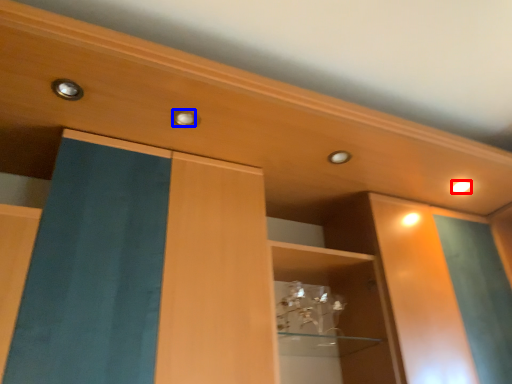
Question: Which point is closer to the camera, lighting (highlighted by a red box) or knob (highlighted by a blue box)?

Choices:
 (A) lighting
 (B) knob

Answer: (B)